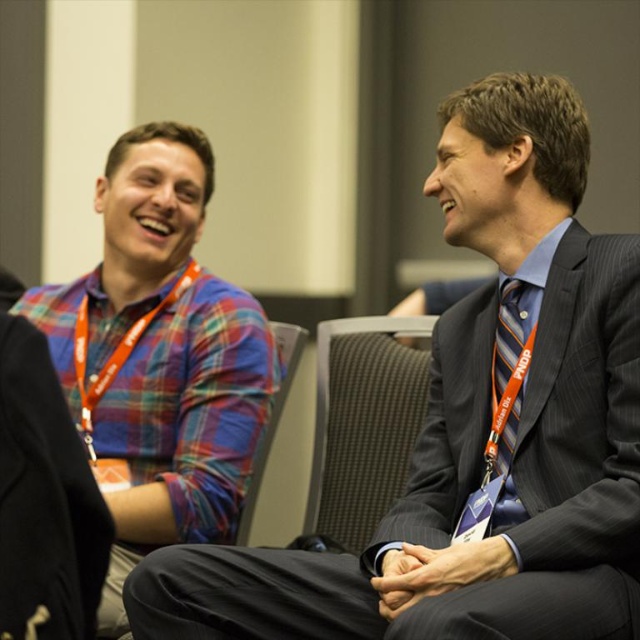
Question: Which point is closer to the camera?

Choices:
 (A) tap(512, 362)
 (B) tap(93, 438)
 (C) tap(269, 323)

Answer: (A)

Question: Is plaid fabric shirt at upper left thinner than dark gray fabric chair at center?

Choices:
 (A) no
 (B) yes

Answer: (A)

Question: Among these objects, which one is nearest to the camera?

Choices:
 (A) plaid fabric shirt at upper left
 (B) gray fabric chair at center
 (C) striped fabric tie at right
 (D) plaid fabric shirt at left

Answer: (A)

Question: Is the position of plaid fabric shirt at left less distant than that of dark gray fabric chair at center?

Choices:
 (A) yes
 (B) no

Answer: (A)

Question: Does plaid fabric shirt at left come behind striped fabric tie at right?

Choices:
 (A) yes
 (B) no

Answer: (A)

Question: Estimate the real-world distances between objects in this image. Which object is farther from the striped fabric tie at right?

Choices:
 (A) plaid fabric shirt at upper left
 (B) plaid fabric shirt at left
 (C) dark gray fabric chair at center

Answer: (B)